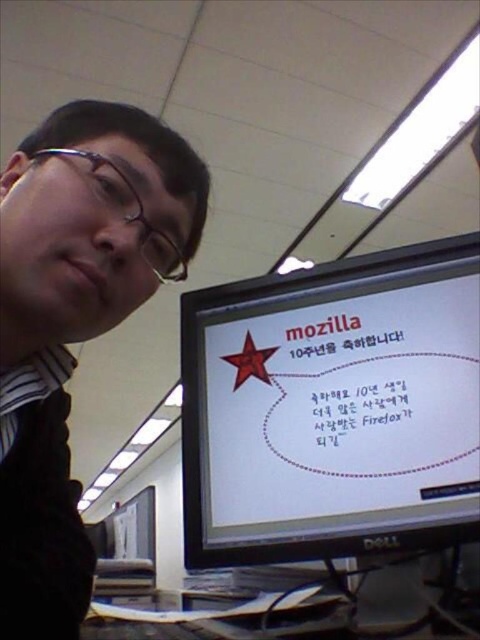
Is point (454, 285) closer to viewer compared to point (54, 205)?

No, (454, 285) is behind (54, 205).

Who is more distant from viewer, (373, 506) or (38, 426)?

Positioned behind is point (373, 506).

Locate an element on the screen. white glossy monitor at center is located at coordinates (333, 406).